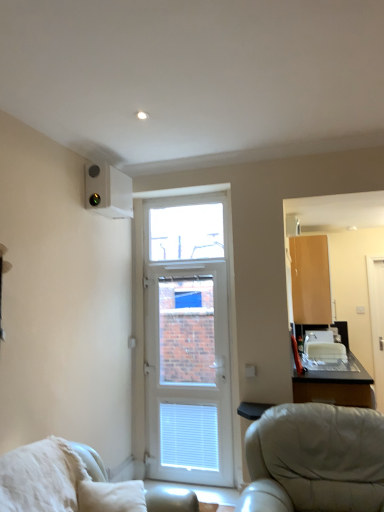
The image size is (384, 512). Describe the element at coordinates (185, 337) in the screenshot. I see `white plastic door at center` at that location.

The image size is (384, 512). In order to click on white plastic air conditioning unit at upper left in this screenshot , I will do `click(108, 191)`.

From the image's perspective, is transparent glass window at center located above matte wood cabinet at upper right?

Indeed, from the image's perspective, transparent glass window at center is shown above matte wood cabinet at upper right.

From the picture: Is transparent glass window at center outside of matte wood cabinet at upper right?

Yes, transparent glass window at center is outside of matte wood cabinet at upper right.

Would you consider matte wood cabinet at upper right to be distant from white glossy screen door at right?

matte wood cabinet at upper right is near white glossy screen door at right, not far away.

Who is shorter, matte wood cabinet at upper right or white glossy screen door at right?

matte wood cabinet at upper right.

Is matte wood cabinet at upper right thinner than white glossy screen door at right?

No, matte wood cabinet at upper right is not thinner than white glossy screen door at right.

This screenshot has height=512, width=384. I want to click on door above the white leather chair at lower left (from a real-world perspective), so click(185, 337).

Is white leather chair at lower left turned away from white plastic door at center?

white leather chair at lower left is not turned away from white plastic door at center.

From a real-world perspective, is white leather chair at lower left over white plastic door at center?

No, from a real-world perspective, white leather chair at lower left is not over white plastic door at center

Is white leather chair at lower left not close to white plastic door at center?

Yes, white leather chair at lower left and white plastic door at center are quite far apart.

Who is smaller, matte wood cabinet at upper right or white leather chair at lower left?

matte wood cabinet at upper right.

Is matte wood cabinet at upper right oriented towards white leather chair at lower left?

Answer: No, matte wood cabinet at upper right is not turned towards white leather chair at lower left.

Identify the location of chair that is in front of the matte wood cabinet at upper right. Image resolution: width=384 pixels, height=512 pixels. (74, 483).

Who is shorter, matte wood cabinet at upper right or white leather chair at lower left?

white leather chair at lower left.

From a real-world perspective, which object rests below the other?

white leather chair at lower left is physically lower.

Between white leather chair at lower left and white fluffy pillow at lower left, which one appears on the right side from the viewer's perspective?

white leather chair at lower left is more to the right.

Between white leather chair at lower left and white fluffy pillow at lower left, which one is positioned behind?

white fluffy pillow at lower left is behind.

In terms of width, does white leather chair at lower left look wider or thinner when compared to white fluffy pillow at lower left?

Considering their sizes, white leather chair at lower left looks broader than white fluffy pillow at lower left.

Relative to white glossy screen door at right, is white plastic door at center in front or behind?

white plastic door at center is positioned closer to the viewer than white glossy screen door at right.

Measure the distance between white plastic door at center and white glossy screen door at right.

white plastic door at center and white glossy screen door at right are 7.48 feet apart from each other.

Between white plastic door at center and white glossy screen door at right, which one appears on the left side from the viewer's perspective?

white plastic door at center is more to the left.

Would you consider white fluffy pillow at lower left to be distant from white glossy screen door at right?

Yes.

From the image's perspective, is white fluffy pillow at lower left above white glossy screen door at right?

Actually, white fluffy pillow at lower left appears below white glossy screen door at right in the image.

Which is correct: white fluffy pillow at lower left is inside white glossy screen door at right, or outside of it?

white fluffy pillow at lower left is not inside white glossy screen door at right, it's outside.

Between white fluffy pillow at lower left and white glossy screen door at right, which one has less height?

white fluffy pillow at lower left is shorter.

What are the coordinates of `cabinetry located on the right of transparent glass window at center` in the screenshot? It's located at (310, 279).

Image resolution: width=384 pixels, height=512 pixels. I want to click on cabinetry located above the white glossy screen door at right (from the image's perspective), so click(x=310, y=279).

Looking at the image, which one is located closer to white leather chair at lower left, white glossy screen door at right or white plastic air conditioning unit at upper left?

white plastic air conditioning unit at upper left.

Based on their spatial positions, is white plastic air conditioning unit at upper left or white fluffy pillow at lower left closer to white plastic door at center?

The object closer to white plastic door at center is white plastic air conditioning unit at upper left.

When comparing their distances from white plastic air conditioning unit at upper left, does matte wood cabinet at upper right or transparent glass window at center seem further?

matte wood cabinet at upper right is positioned further to the anchor white plastic air conditioning unit at upper left.

When comparing their distances from white plastic air conditioning unit at upper left, does white glossy screen door at right or white plastic door at center seem closer?

white plastic door at center is closer to white plastic air conditioning unit at upper left.

When comparing their distances from white fluffy pillow at lower left, does white plastic air conditioning unit at upper left or white glossy screen door at right seem closer?

Based on the image, white plastic air conditioning unit at upper left appears to be nearer to white fluffy pillow at lower left.

When comparing their distances from matte wood cabinet at upper right, does white glossy screen door at right or white plastic door at center seem further?

white plastic door at center lies further to matte wood cabinet at upper right than the other object.

Based on their spatial positions, is white leather chair at lower left or white plastic air conditioning unit at upper left further from white glossy screen door at right?

white leather chair at lower left is positioned further to the anchor white glossy screen door at right.

Looking at the image, which one is located closer to white fluffy pillow at lower left, matte wood cabinet at upper right or white plastic air conditioning unit at upper left?

Among the two, white plastic air conditioning unit at upper left is located nearer to white fluffy pillow at lower left.

This screenshot has height=512, width=384. In order to click on door between white leather chair at lower left and transparent glass window at center along the z-axis in this screenshot , I will do `click(185, 337)`.

In order to click on pillow positioned between white leather chair at lower left and white plastic air conditioning unit at upper left from near to far in this screenshot , I will do `click(41, 477)`.

Identify the location of window located between white leather chair at lower left and matte wood cabinet at upper right in the depth direction. This screenshot has height=512, width=384. (186, 232).

Where is `door situated between transparent glass window at center and matte wood cabinet at upper right from left to right`? This screenshot has width=384, height=512. door situated between transparent glass window at center and matte wood cabinet at upper right from left to right is located at coordinates (185, 337).